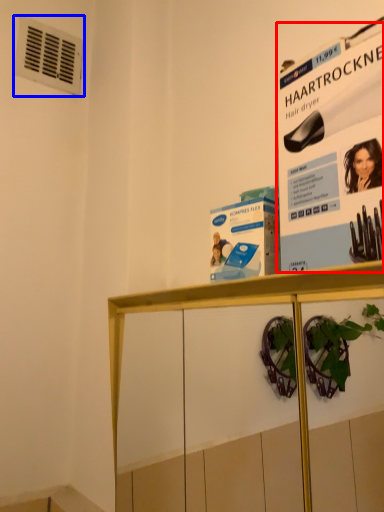
Question: Which object is further to the camera taking this photo, poster page (highlighted by a red box) or air conditioning (highlighted by a blue box)?

Choices:
 (A) poster page
 (B) air conditioning

Answer: (B)